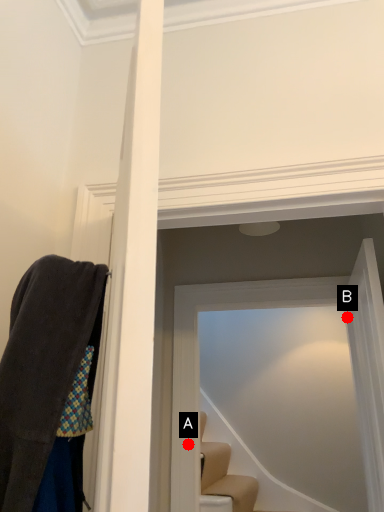
Question: Two points are circled on the image, labeled by A and B beside each circle. Which point is closer to the camera?

Choices:
 (A) A is closer
 (B) B is closer

Answer: (B)